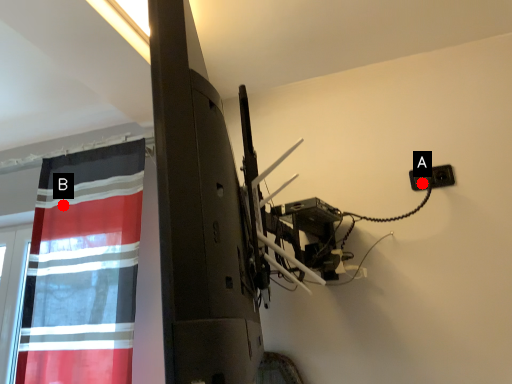
Question: Two points are circled on the image, labeled by A and B beside each circle. Which of the following is the farthest from the observer?

Choices:
 (A) A is further
 (B) B is further

Answer: (B)